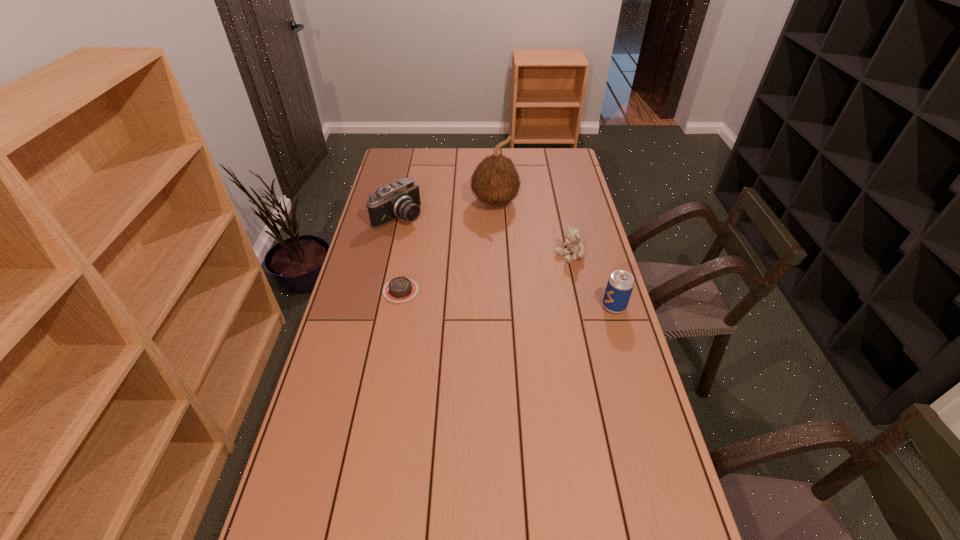
The width and height of the screenshot is (960, 540). In order to click on free space on the desktop that is between the chocolate cake and the rightmost object and is positioned on the face of the teddy bear in this screenshot , I will do `click(474, 296)`.

This screenshot has height=540, width=960. In order to click on free space on the desktop that is between the chocolate cake and the rightmost object and is positioned on the front-facing side of the camera in this screenshot , I will do `click(517, 299)`.

This screenshot has height=540, width=960. I want to click on vacant space on the desktop that is between the shortest object and the rightmost object and is positioned on the surface of the third object from right to left, so click(516, 299).